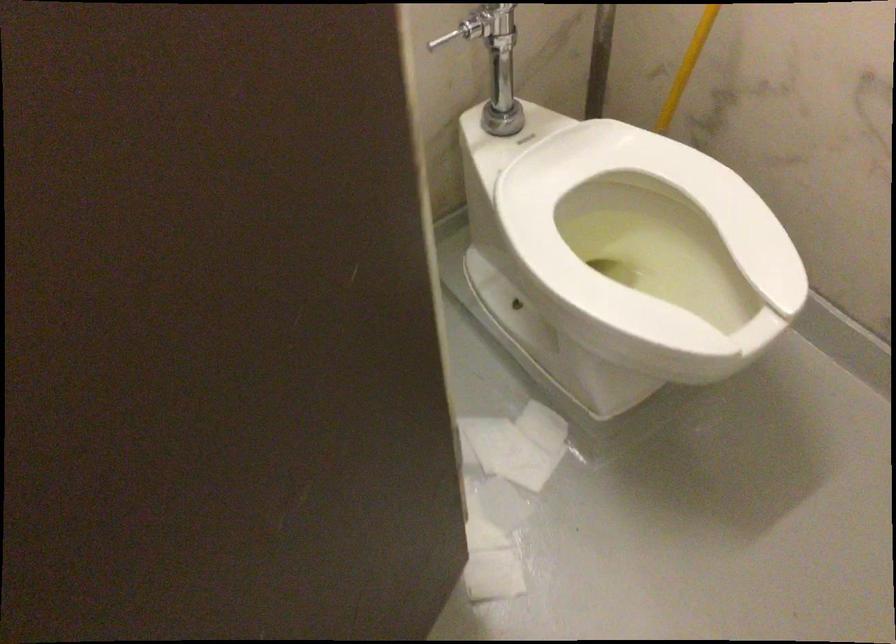
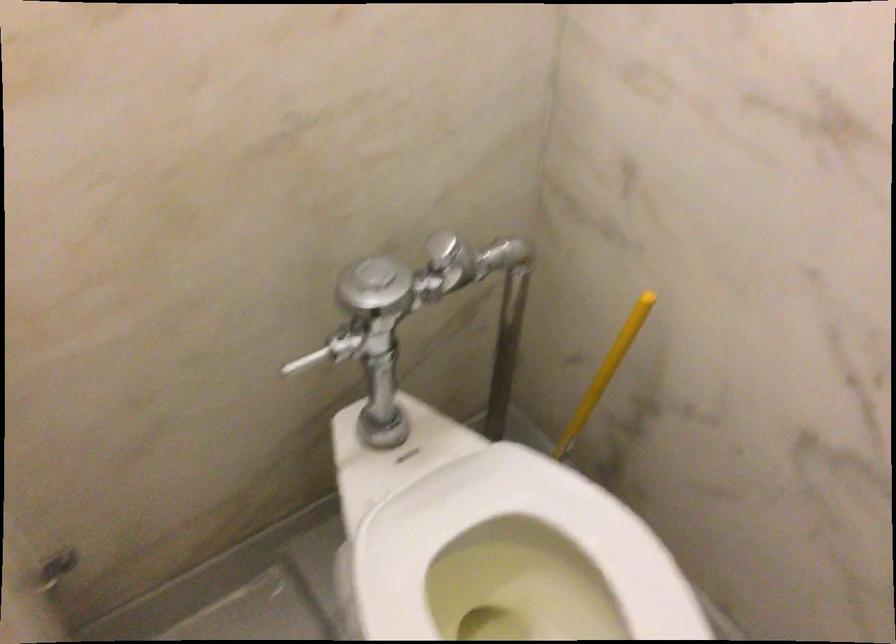
Question: The images are taken continuously from a first-person perspective. In which direction is your viewpoint rotating?

Choices:
 (A) Left
 (B) Right
 (C) Up
 (D) Down

Answer: (C)